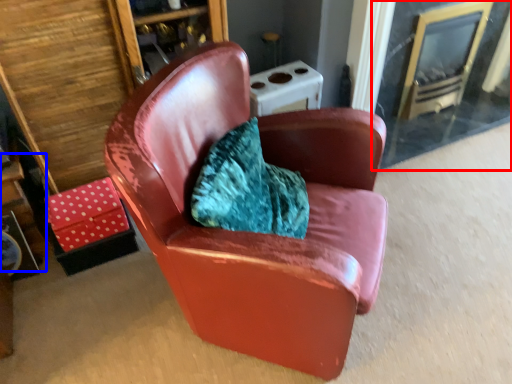
Question: Which point is further to the camera, glass door (highlighted by a red box) or table (highlighted by a blue box)?

Choices:
 (A) glass door
 (B) table

Answer: (A)